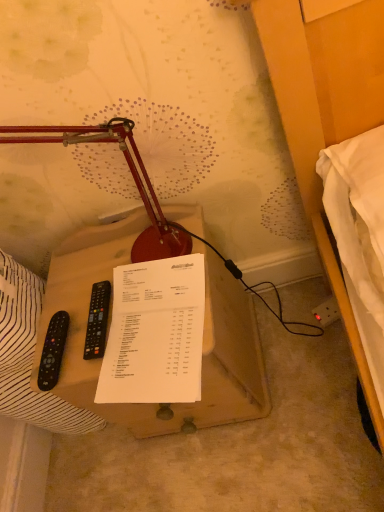
You are a GUI agent. You are given a task and a screenshot of the screen. Output one action in this format:
    pyautogui.click(x=<x>, y=<y>)
    Task: Click on the free spot below matte red lamp at center (from a real-world perspective)
    The width and height of the screenshot is (384, 512).
    Given the screenshot: What is the action you would take?
    pyautogui.click(x=90, y=276)